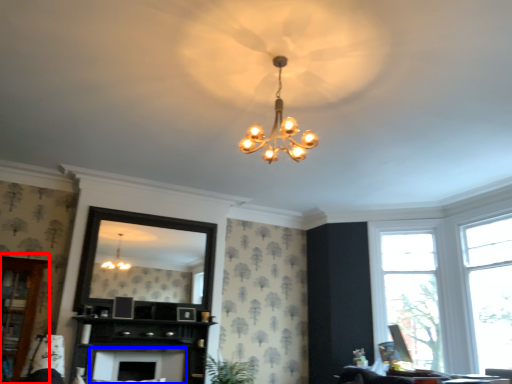
Question: Among these objects, which one is nearest to the camera, dresser (highlighted by a red box) or fireplace (highlighted by a blue box)?

Choices:
 (A) dresser
 (B) fireplace

Answer: (A)